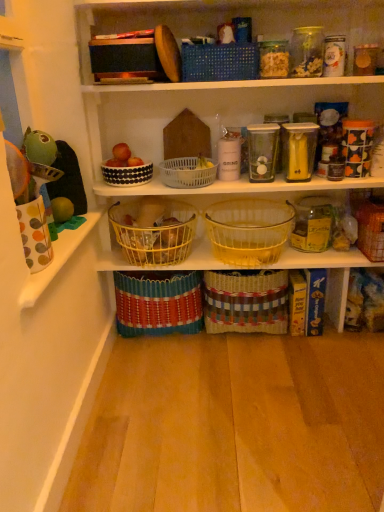
The image size is (384, 512). In order to click on vacant space in front of woven fabric basket at center, which is the first basket in bottom-to-top order in this screenshot , I will do `click(173, 366)`.